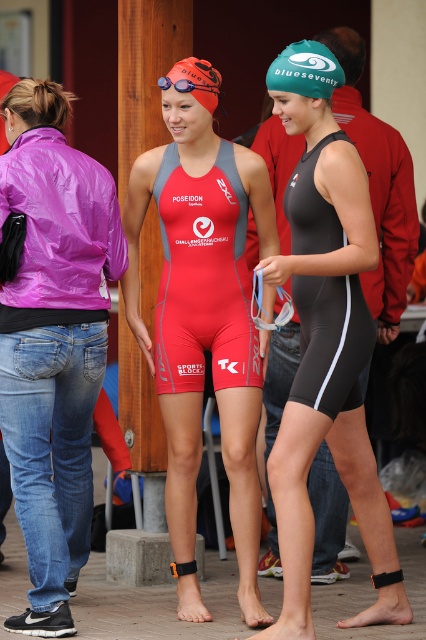
Which is above, matte red swimsuit at center or orange matte swim cap at upper center?

Positioned higher is orange matte swim cap at upper center.

From the picture: Is matte red swimsuit at center positioned in front of orange matte swim cap at upper center?

Yes, matte red swimsuit at center is closer to the viewer.

Where is `matte red swimsuit at center`? The image size is (426, 640). matte red swimsuit at center is located at coordinates (203, 326).

Is matte black swimsuit at center above black matte wetsuit at center?

No.

Between matte black swimsuit at center and black matte wetsuit at center, which one is positioned higher?

Positioned higher is black matte wetsuit at center.

I want to click on matte black swimsuit at center, so (x=328, y=364).

Is the position of matte red swimsuit at center less distant than that of matte black swimsuit at center?

No.

Does matte red swimsuit at center have a lesser height compared to matte black swimsuit at center?

In fact, matte red swimsuit at center may be taller than matte black swimsuit at center.

Which is in front, point (258, 496) or point (310, 346)?

Point (310, 346)

Find the location of a particular element. matte red swimsuit at center is located at coordinates (203, 326).